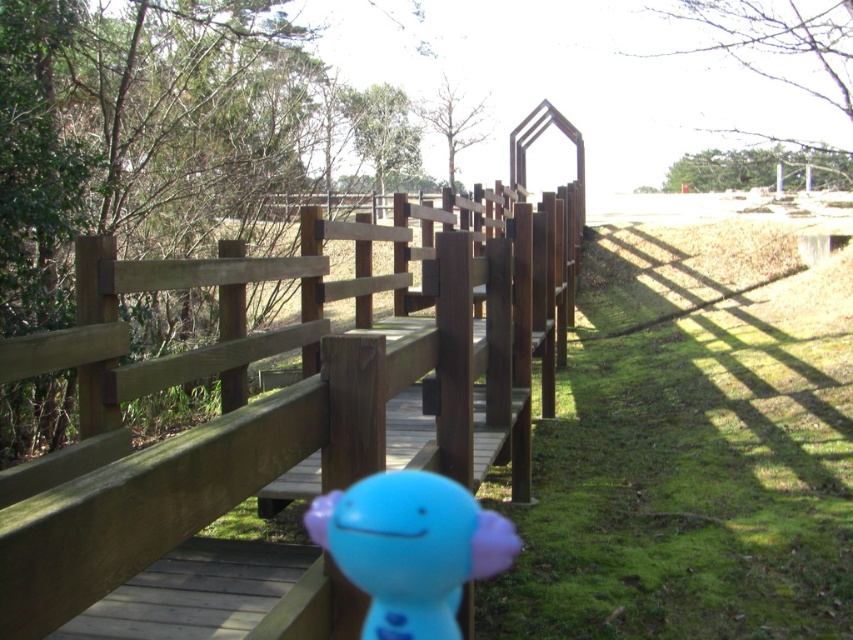
Does wooden bridge at center appear under blue rubber toy at center?

No, wooden bridge at center is not below blue rubber toy at center.

Consider the image. Which is more to the left, wooden bridge at center or blue rubber toy at center?

Positioned to the left is blue rubber toy at center.

Describe the element at coordinates (291, 385) in the screenshot. The height and width of the screenshot is (640, 853). I see `wooden bridge at center` at that location.

You are a GUI agent. You are given a task and a screenshot of the screen. Output one action in this format:
    pyautogui.click(x=<x>, y=<y>)
    Task: Click on the wooden bridge at center
    
    Given the screenshot: What is the action you would take?
    click(x=291, y=385)